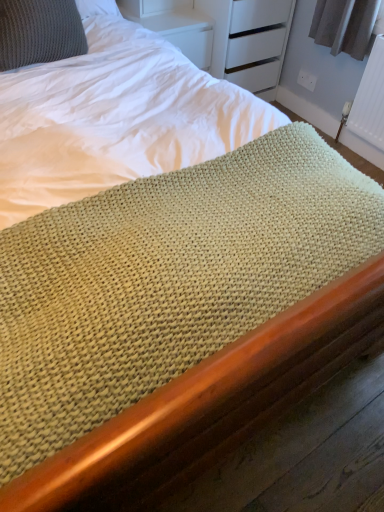
Question: Is knitted gray pillow at upper left not within white textured radiator at upper right?

Choices:
 (A) no
 (B) yes

Answer: (B)

Question: Is knitted gray pillow at upper left facing towards white textured radiator at upper right?

Choices:
 (A) yes
 (B) no

Answer: (B)

Question: Is knitted gray pillow at upper left at the left side of white textured radiator at upper right?

Choices:
 (A) yes
 (B) no

Answer: (A)

Question: From a real-world perspective, is knitted gray pillow at upper left physically above white textured radiator at upper right?

Choices:
 (A) yes
 (B) no

Answer: (A)

Question: From the image's perspective, is knitted gray pillow at upper left on top of white textured radiator at upper right?

Choices:
 (A) no
 (B) yes

Answer: (B)

Question: Is knitted gray pillow at upper left looking in the opposite direction of white textured radiator at upper right?

Choices:
 (A) no
 (B) yes

Answer: (A)

Question: Does white textured radiator at upper right appear on the right side of knitted gray pillow at upper left?

Choices:
 (A) yes
 (B) no

Answer: (A)

Question: Is white textured radiator at upper right wider than knitted gray pillow at upper left?

Choices:
 (A) no
 (B) yes

Answer: (A)

Question: Is white textured radiator at upper right in front of knitted gray pillow at upper left?

Choices:
 (A) yes
 (B) no

Answer: (B)

Question: Considering the relative sizes of white textured radiator at upper right and knitted gray pillow at upper left in the image provided, is white textured radiator at upper right shorter than knitted gray pillow at upper left?

Choices:
 (A) no
 (B) yes

Answer: (A)

Question: Does white textured radiator at upper right appear on the left side of knitted gray pillow at upper left?

Choices:
 (A) no
 (B) yes

Answer: (A)

Question: Does white textured radiator at upper right lie behind knitted gray pillow at upper left?

Choices:
 (A) yes
 (B) no

Answer: (A)

Question: In terms of height, does white textured radiator at upper right look taller or shorter compared to knitted gray pillow at upper left?

Choices:
 (A) tall
 (B) short

Answer: (A)